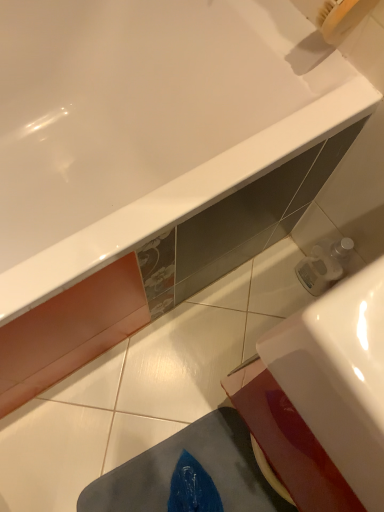
This screenshot has width=384, height=512. Describe the element at coordinates (339, 376) in the screenshot. I see `white glossy sink at lower right` at that location.

This screenshot has width=384, height=512. Identify the location of white glossy sink at lower right. (339, 376).

What is the approximate height of white glossy bathtub at upper center?

white glossy bathtub at upper center is 22.95 inches in height.

Describe the element at coordinates (144, 124) in the screenshot. I see `white glossy bathtub at upper center` at that location.

Locate an element on the screen. This screenshot has width=384, height=512. white glossy bathtub at upper center is located at coordinates (144, 124).

Measure the distance between point [87,197] and camera.

Point [87,197] and camera are 1.03 meters apart from each other.

The height and width of the screenshot is (512, 384). I want to click on white glossy sink at lower right, so click(x=339, y=376).

Can you confirm if white glossy bathtub at upper center is positioned to the right of white glossy sink at lower right?

Incorrect, white glossy bathtub at upper center is not on the right side of white glossy sink at lower right.

Considering the relative positions of white glossy bathtub at upper center and white glossy sink at lower right in the image provided, is white glossy bathtub at upper center in front of white glossy sink at lower right?

No, it is behind white glossy sink at lower right.

Is point (276, 145) closer or farther from the camera than point (376, 413)?

Clearly, point (276, 145) is more distant from the camera than point (376, 413).

From the image's perspective, would you say white glossy bathtub at upper center is positioned over white glossy sink at lower right?

Yes.

In the scene shown: From a real-world perspective, relative to white glossy sink at lower right, is white glossy bathtub at upper center vertically above or below?

white glossy bathtub at upper center is situated lower than white glossy sink at lower right in the real world.

Which of these two, white glossy bathtub at upper center or white glossy sink at lower right, is thinner?

Thinner between the two is white glossy sink at lower right.

Does white glossy bathtub at upper center have a lesser height compared to white glossy sink at lower right?

Correct, white glossy bathtub at upper center is not as tall as white glossy sink at lower right.

Can you confirm if white glossy bathtub at upper center is smaller than white glossy sink at lower right?

No.

Is white glossy bathtub at upper center inside the boundaries of white glossy sink at lower right, or outside?

white glossy bathtub at upper center is not inside white glossy sink at lower right, it's outside.

Does white glossy bathtub at upper center touch white glossy sink at lower right?

white glossy bathtub at upper center and white glossy sink at lower right are clearly separated.

Could you tell me if white glossy bathtub at upper center is turned towards white glossy sink at lower right?

Yes, white glossy bathtub at upper center is oriented towards white glossy sink at lower right.

How far apart are white glossy bathtub at upper center and white glossy sink at lower right?

white glossy bathtub at upper center is 24.57 inches away from white glossy sink at lower right.

Identify the location of sink lying in front of the white glossy bathtub at upper center. (339, 376).

Between white glossy sink at lower right and white glossy bathtub at upper center, which one appears on the left side from the viewer's perspective?

Positioned to the left is white glossy bathtub at upper center.

Is white glossy sink at lower right further to the viewer compared to white glossy bathtub at upper center?

No, it is in front of white glossy bathtub at upper center.

Does point (346, 306) come behind point (0, 42)?

No, it is in front of (0, 42).

From the image's perspective, is white glossy sink at lower right under white glossy bathtub at upper center?

Yes, from the image's perspective, white glossy sink at lower right is beneath white glossy bathtub at upper center.

From a real-world perspective, is white glossy sink at lower right positioned above or below white glossy bathtub at upper center?

Clearly, from a real-world perspective, white glossy sink at lower right is above white glossy bathtub at upper center.

Between white glossy sink at lower right and white glossy bathtub at upper center, which one has smaller width?

Thinner between the two is white glossy sink at lower right.

Does white glossy sink at lower right have a greater height compared to white glossy bathtub at upper center?

Correct, white glossy sink at lower right is much taller as white glossy bathtub at upper center.

Based on the photo, who is smaller, white glossy sink at lower right or white glossy bathtub at upper center?

white glossy sink at lower right.

Does white glossy sink at lower right contain white glossy bathtub at upper center?

No, white glossy bathtub at upper center is not inside white glossy sink at lower right.

Is white glossy sink at lower right beside white glossy bathtub at upper center?

No, white glossy sink at lower right is not with white glossy bathtub at upper center.

Is white glossy sink at lower right facing away from white glossy bathtub at upper center?

No, white glossy sink at lower right's orientation is not away from white glossy bathtub at upper center.

The image size is (384, 512). What are the coordinates of `bathtub below the white glossy sink at lower right (from a real-world perspective)` in the screenshot? It's located at (144, 124).

This screenshot has width=384, height=512. Find the location of `bathtub above the white glossy sink at lower right (from the image's perspective)`. bathtub above the white glossy sink at lower right (from the image's perspective) is located at coordinates (144, 124).

In the image, there is a white glossy sink at lower right. At what (x,y) coordinates should I click in order to perform the action: click on bathtub below it (from a real-world perspective). Please return your answer as a coordinate pair (x, y). Looking at the image, I should click on (144, 124).